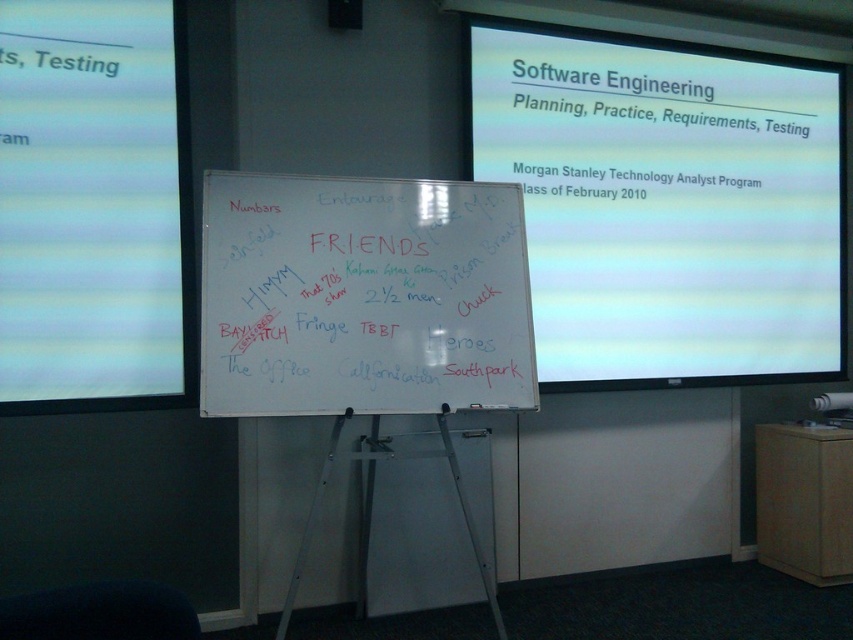
Question: Observing the image, what is the correct spatial positioning of white glossy projector screen at upper center in reference to whiteboard at center?

Choices:
 (A) below
 (B) above

Answer: (B)

Question: Is white glossy projector screen at upper center thinner than whiteboard at center?

Choices:
 (A) no
 (B) yes

Answer: (A)

Question: Is white glossy projector screen at upper center thinner than whiteboard at center?

Choices:
 (A) yes
 (B) no

Answer: (B)

Question: Which point is closer to the camera?

Choices:
 (A) (490, 323)
 (B) (109, 317)
 (C) (548, 128)

Answer: (B)

Question: Which of the following is the closest to the observer?

Choices:
 (A) white glossy projector screen at upper center
 (B) white matte projection screen at upper left
 (C) whiteboard at center

Answer: (C)

Question: Which of the following is the farthest from the observer?

Choices:
 (A) (213, 259)
 (B) (119, 337)
 (C) (480, 120)

Answer: (C)